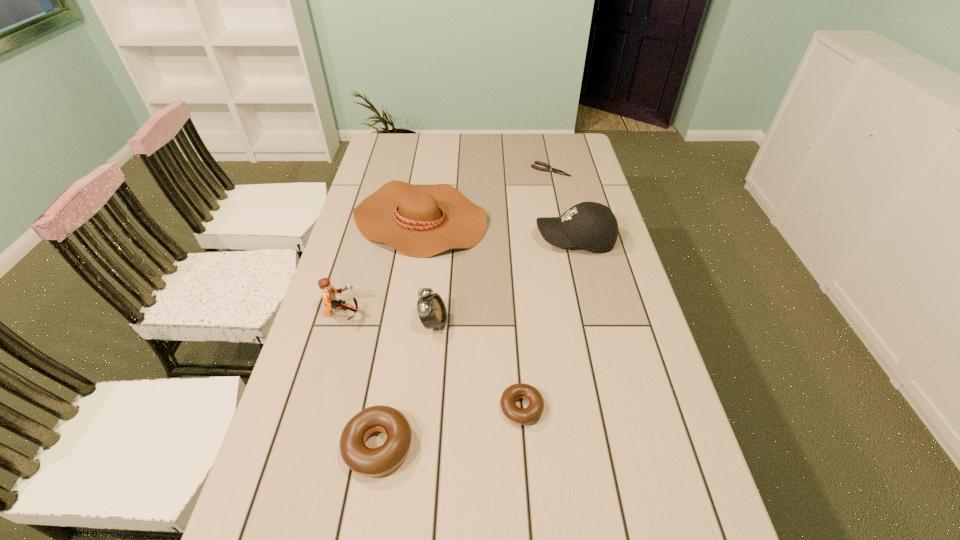
Where is `vacant region located on the right of the left doughnut`? This screenshot has width=960, height=540. vacant region located on the right of the left doughnut is located at coordinates (478, 446).

The width and height of the screenshot is (960, 540). I want to click on vacant region located 0.160m on the left of the fifth object from left to right, so pyautogui.click(x=430, y=408).

The height and width of the screenshot is (540, 960). In order to click on free region located on the front of the shortest object in this screenshot , I will do `click(557, 198)`.

Locate an element on the screen. The height and width of the screenshot is (540, 960). free spot located 0.070m on the back of the cowboy hat is located at coordinates (426, 176).

This screenshot has width=960, height=540. I want to click on free region located 0.050m on the face of the alarm clock, so click(x=466, y=323).

Locate an element on the screen. vacant space situated 0.220m on the front-facing side of the baseball cap is located at coordinates (468, 239).

The image size is (960, 540). Find the location of `free location located on the front-facing side of the baseball cap`. free location located on the front-facing side of the baseball cap is located at coordinates (424, 239).

Where is `free region located on the front-facing side of the baseball cap`? free region located on the front-facing side of the baseball cap is located at coordinates (510, 239).

At what (x,y) coordinates should I click in order to perform the action: click on free space located 0.210m holding a crossbow in the hands of the Lego. Please return your answer as a coordinate pair (x, y). Looking at the image, I should click on (438, 313).

The image size is (960, 540). Find the location of `doughnut that is at the left edge`. doughnut that is at the left edge is located at coordinates (370, 462).